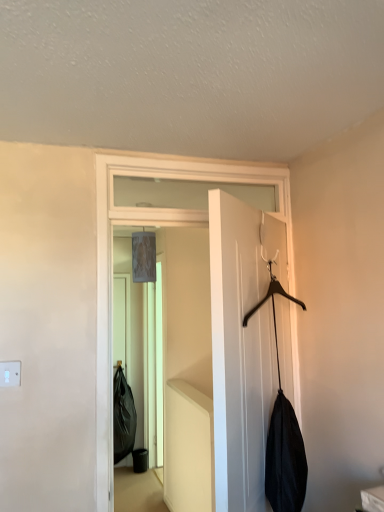
Question: Is white matte door at center, which is the 1th door in front-to-back order, spatially inside white matte door at center, the first door in the back-to-front sequence, or outside of it?

Choices:
 (A) outside
 (B) inside

Answer: (A)

Question: Is white matte door at center, placed as the second door when sorted from back to front, in front of or behind white matte door at center, the first door in the back-to-front sequence, in the image?

Choices:
 (A) front
 (B) behind

Answer: (A)

Question: Does point (254, 342) appear closer or farther from the camera than point (165, 219)?

Choices:
 (A) closer
 (B) farther

Answer: (A)

Question: In terms of width, does white matte door at center, the first door in the back-to-front sequence, look wider or thinner when compared to white matte door at center, placed as the second door when sorted from back to front?

Choices:
 (A) thin
 (B) wide

Answer: (A)

Question: From a real-world perspective, is white matte door at center, placed as the 2th door when sorted from front to back, positioned above or below white matte door at center, which is the 1th door in front-to-back order?

Choices:
 (A) below
 (B) above

Answer: (B)

Question: Considering their positions, is white matte door at center, the first door in the back-to-front sequence, located in front of or behind white matte door at center, which is the 1th door in front-to-back order?

Choices:
 (A) front
 (B) behind

Answer: (B)

Question: From the image's perspective, is white matte door at center, the first door in the back-to-front sequence, above or below white matte door at center, which is the 1th door in front-to-back order?

Choices:
 (A) below
 (B) above

Answer: (B)